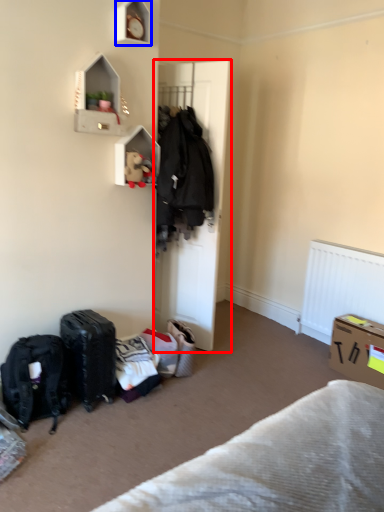
Question: Which point is closer to the camera, door (highlighted by a red box) or shelf (highlighted by a blue box)?

Choices:
 (A) door
 (B) shelf

Answer: (B)